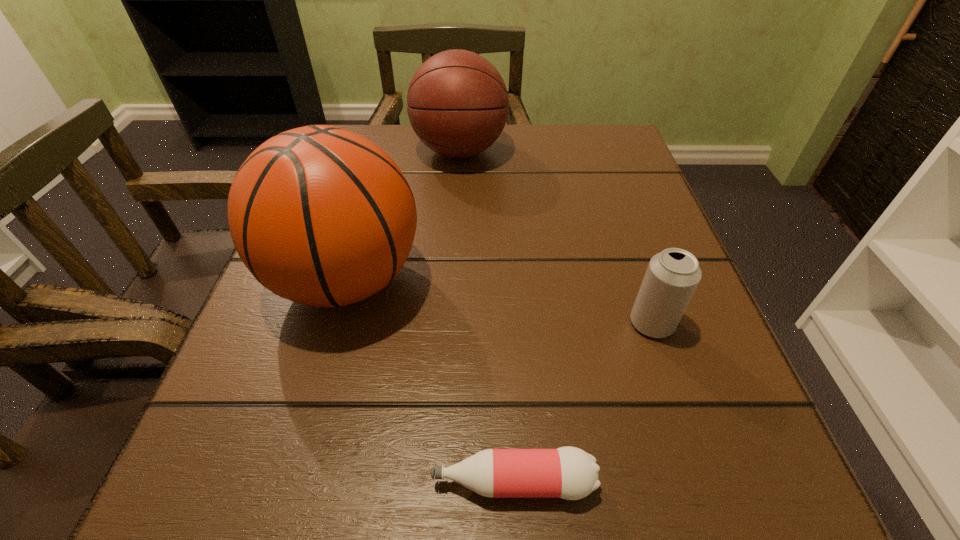
This screenshot has height=540, width=960. What are the coordinates of `vacant area that lies between the farthest object and the shortest object` in the screenshot? It's located at (487, 316).

You are a GUI agent. You are given a task and a screenshot of the screen. Output one action in this format:
    pyautogui.click(x=<x>, y=<y>)
    Task: Click on the blank region between the rightmost object and the bottle
    The image size is (960, 540).
    Given the screenshot: What is the action you would take?
    pyautogui.click(x=583, y=402)

Image resolution: width=960 pixels, height=540 pixels. I want to click on vacant area that lies between the second tallest object and the shortest object, so click(x=487, y=316).

Find the location of a particular element. The width and height of the screenshot is (960, 540). object that ranks as the second closest to the third shortest object is located at coordinates (672, 276).

Locate which object is the third closest to the beer can. Please provide its 2D coordinates. Your answer should be formatted as a tuple, i.e. [(x, y)], where the tuple contains the x and y coordinates of a point satisfying the conditions above.

[(457, 103)]

This screenshot has width=960, height=540. What are the coordinates of `blank area in the image that satisfies the following two spatial constraints: 1. on the front side of the second shortest object; 2. on the right side of the nearer basketball` in the screenshot? It's located at (334, 323).

The width and height of the screenshot is (960, 540). Identify the location of vacant space that satisfies the following two spatial constraints: 1. on the front side of the third tallest object; 2. on the right side of the third shortest object. (449, 323).